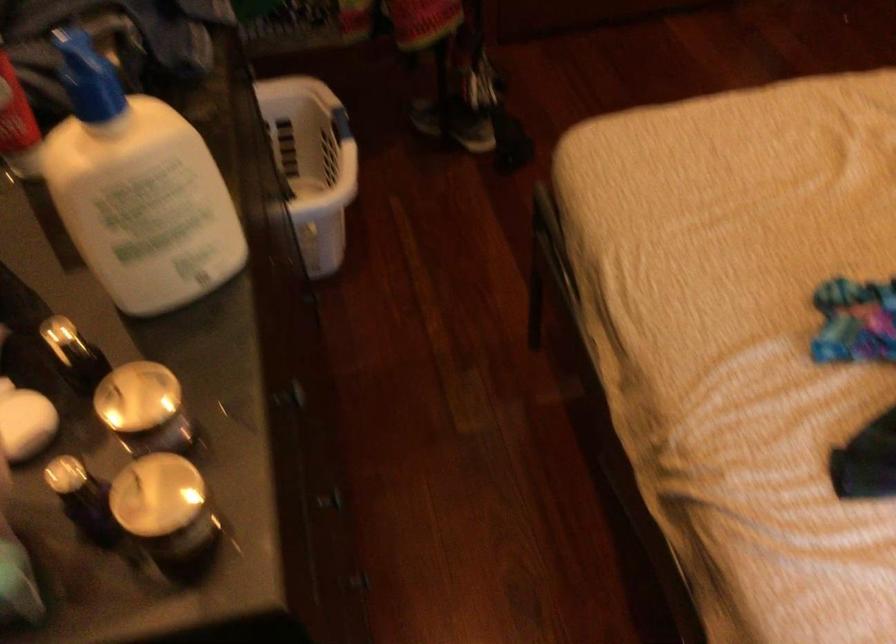
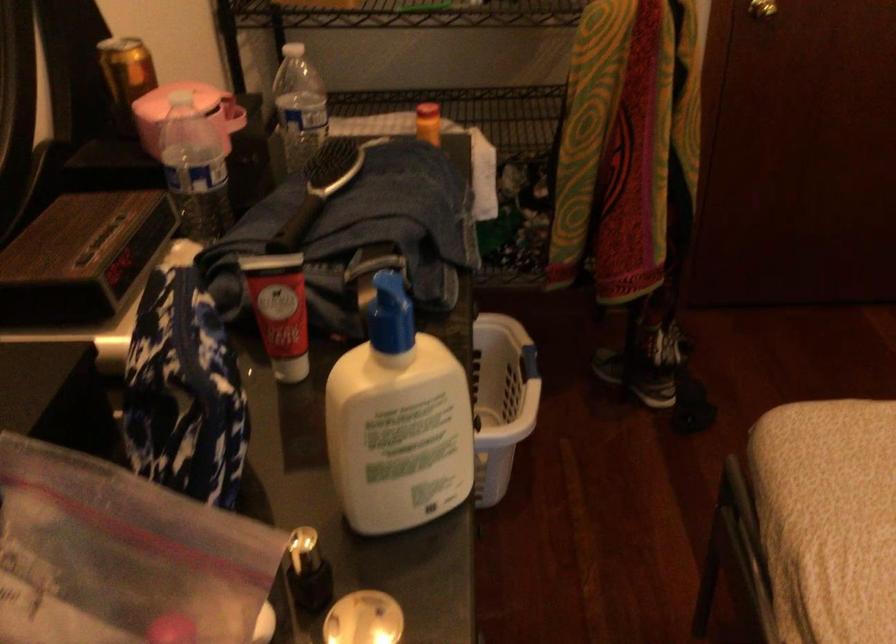
Find the pixel in the second image that matches point 334,124 in the first image.

(529, 363)